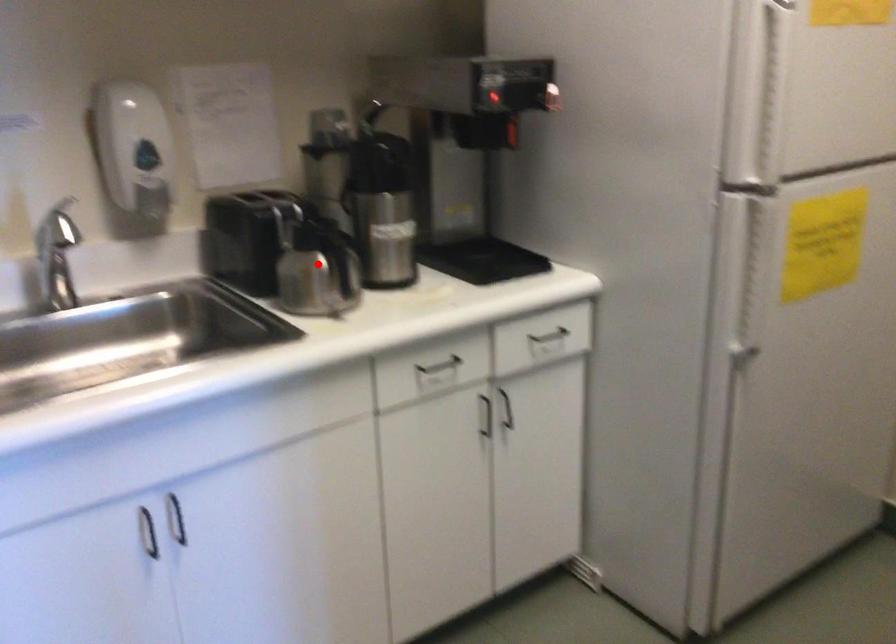
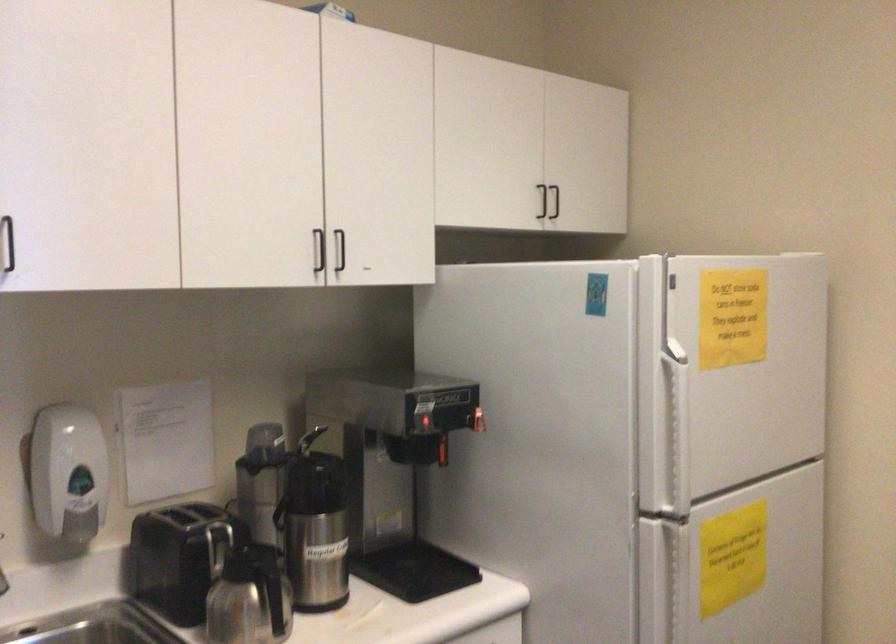
Where in the second image is the point corresponding to the highlighted location from the first image?

(251, 599)